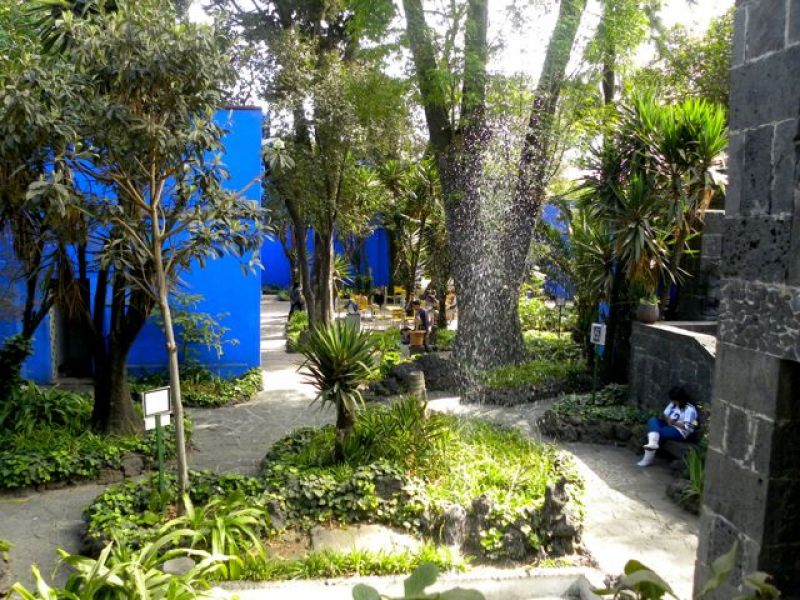
Identify the location of wall. The height and width of the screenshot is (600, 800). (757, 269).